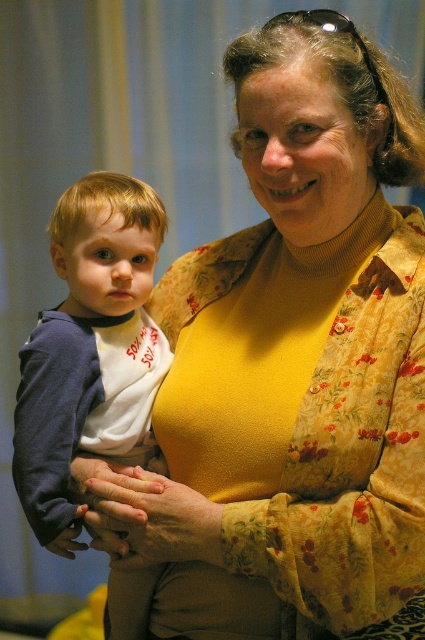
Question: Which point appears farthest from the camera in this image?

Choices:
 (A) (152, 240)
 (B) (337, 17)

Answer: (A)

Question: Is the position of matte blue sweater at left more distant than that of black plastic sunglasses at upper center?

Choices:
 (A) no
 (B) yes

Answer: (B)

Question: Does matte blue sweater at left have a lesser width compared to black plastic sunglasses at upper center?

Choices:
 (A) no
 (B) yes

Answer: (A)

Question: Which point is closer to the camera?

Choices:
 (A) black plastic sunglasses at upper center
 (B) matte blue sweater at left

Answer: (A)

Question: Is matte blue sweater at left further to camera compared to black plastic sunglasses at upper center?

Choices:
 (A) yes
 (B) no

Answer: (A)

Question: Which point appears farthest from the camera in this image?

Choices:
 (A) (110, 188)
 (B) (377, 74)

Answer: (A)